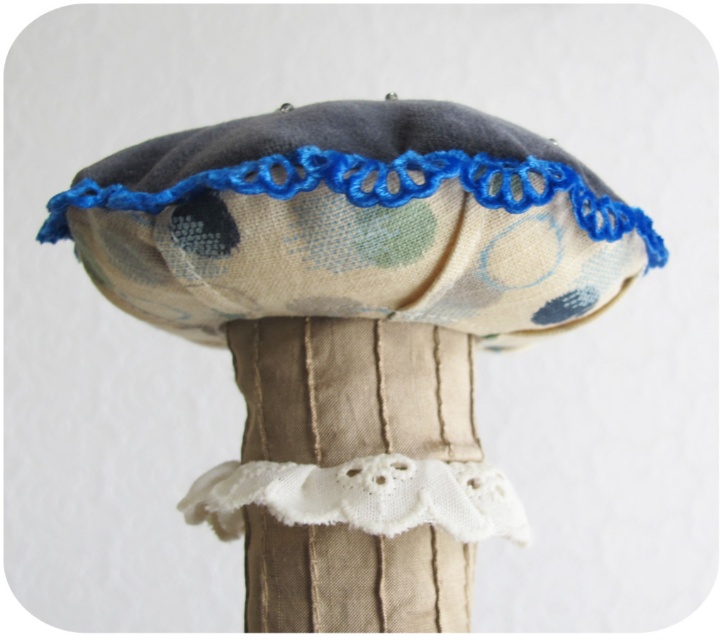
You are looking at the handmade mushroom fabric art piece. The floral fabric hat at center and the white lace trim at center are both visible. Which object is nearer to you?

The floral fabric hat at center is closer to the viewer than the white lace trim at center.

You are organizing a craft fair booth and need to arrange items on a display table. You have a floral fabric hat at upper center and a white textured cloth at center. According to the image, which item is placed above the other?

The floral fabric hat at upper center is positioned over the white textured cloth at center, so it is placed above the cloth.